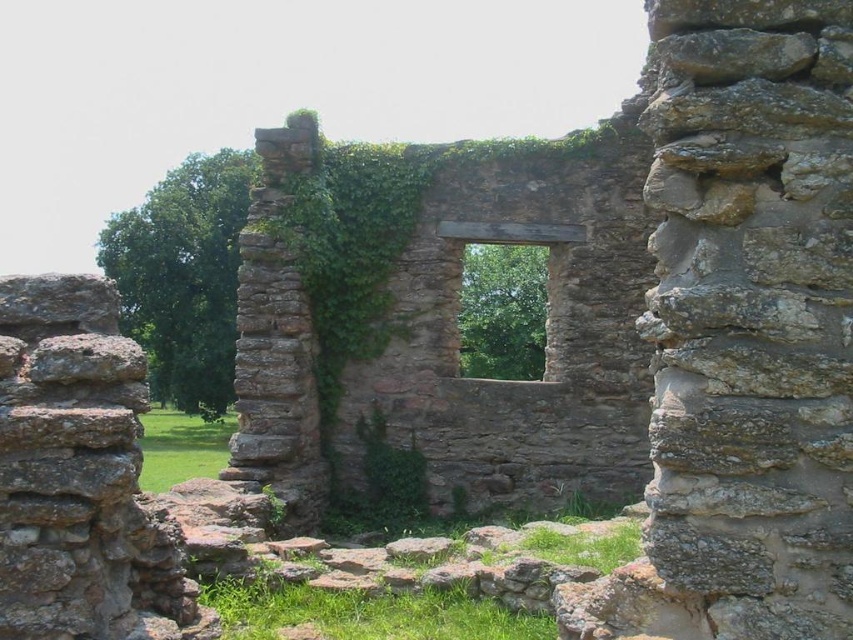
Who is more forward, (x=167, y=358) or (x=518, y=252)?

Point (x=518, y=252)

Locate an element on the screen. Image resolution: width=853 pixels, height=640 pixels. green leafy ivy at center is located at coordinates (183, 275).

Locate an element on the screen. The width and height of the screenshot is (853, 640). green leafy ivy at center is located at coordinates (183, 275).

Where is `green leafy ivy at center`? This screenshot has height=640, width=853. green leafy ivy at center is located at coordinates (183, 275).